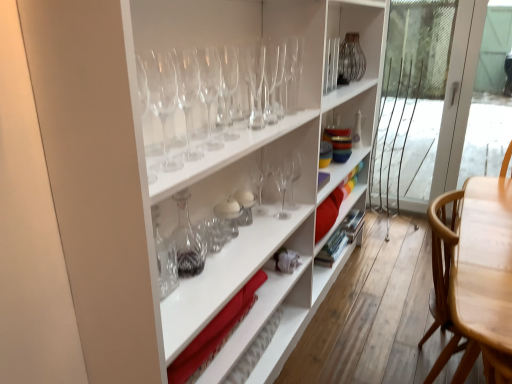
Question: From their relative heights in the image, would you say clear glass wine glass at upper center, which is counted as the 4th wine glass, starting from the back, is taller or shorter than transparent glass wine glass at center, which is the fifth wine glass from front to back?

Choices:
 (A) tall
 (B) short

Answer: (B)

Question: Does point (283, 76) appear closer or farther from the camera than point (250, 92)?

Choices:
 (A) closer
 (B) farther

Answer: (B)

Question: Which object is positioned farthest from the clear glass wine glass at center, which is the 3th wine glass from front to back?

Choices:
 (A) transparent glass wine glass at upper center, which is the fifth wine glass in back-to-front order
 (B) transparent glass wine glass at center, the ninth wine glass when ordered from front to back
 (C) transparent glass wine glasses at upper center, which is the 9th wine glass from back to front
 (D) transparent glass wine glass at center, the 8th wine glass viewed from the front
 (E) clear glass decanter at center

Answer: (D)

Question: Estimate the real-world distances between objects in this image. Which object is closer to the transparent glass wine glass at upper center, the 1th wine glass positioned from the front?

Choices:
 (A) transparent glass wine glass at center, the tenth wine glass in the front-to-back sequence
 (B) transparent glass wine glass at upper center, arranged as the 4th wine glass when viewed from the front
 (C) light brown wood chair at right
 (D) transparent glass wine glass at center, arranged as the sixth wine glass when viewed from the back
 (E) clear glass decanter at center

Answer: (B)